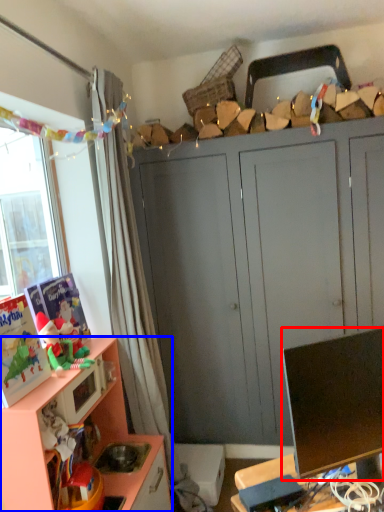
Question: Which object is closer to the camera taking this photo, television (highlighted by a red box) or cabinetry (highlighted by a blue box)?

Choices:
 (A) television
 (B) cabinetry

Answer: (A)